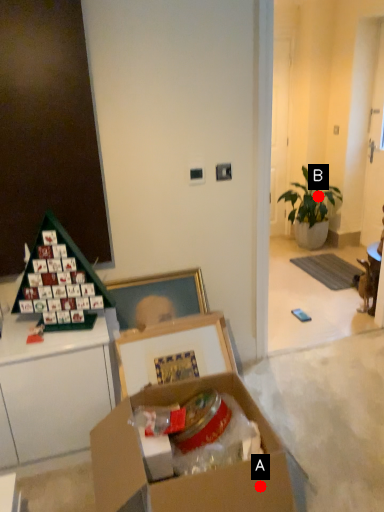
Question: Two points are circled on the image, labeled by A and B beside each circle. Which point is closer to the camera?

Choices:
 (A) A is closer
 (B) B is closer

Answer: (A)